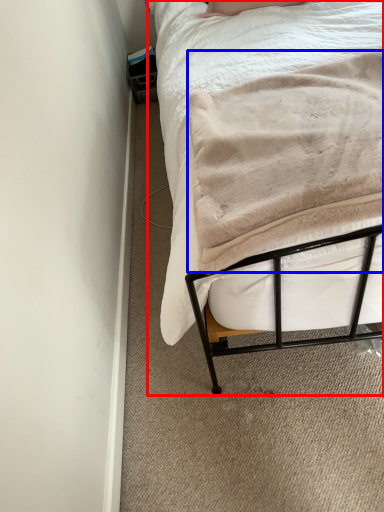
Question: Which point is closer to the camera, bed (highlighted by a red box) or blanket (highlighted by a blue box)?

Choices:
 (A) bed
 (B) blanket

Answer: (B)